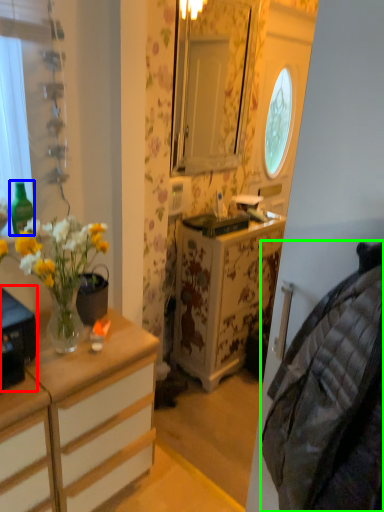
Question: Which is farther away from desk (highlighted by a red box)? bottle (highlighted by a blue box) or material (highlighted by a green box)?

Choices:
 (A) bottle
 (B) material

Answer: (B)